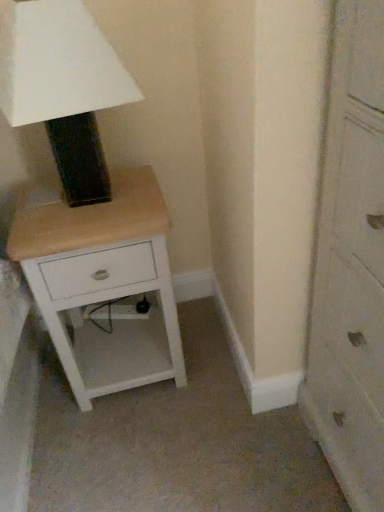
Locate an element on the screen. The height and width of the screenshot is (512, 384). empty space that is ontop of white wood nightstand at lower left is located at coordinates (105, 202).